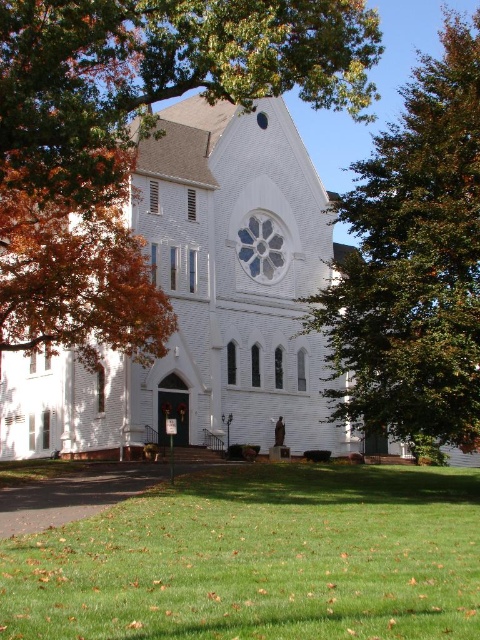
Question: Is green grass at lower center to the left of white brick church at center from the viewer's perspective?

Choices:
 (A) yes
 (B) no

Answer: (B)

Question: Which of the following is the closest to the observer?

Choices:
 (A) (308, 628)
 (B) (407, 268)
 (C) (267, 106)

Answer: (A)

Question: Among these objects, which one is nearest to the camera?

Choices:
 (A) white brick church at center
 (B) green grass at lower center
 (C) green leafy tree at upper right

Answer: (B)

Question: Which point is farther from the camera taking this photo?

Choices:
 (A) (291, 145)
 (B) (465, 522)

Answer: (A)

Question: Is white brick church at center thinner than green leafy tree at upper right?

Choices:
 (A) yes
 (B) no

Answer: (B)

Question: Does white brick church at center appear over green leafy tree at upper right?

Choices:
 (A) no
 (B) yes

Answer: (A)